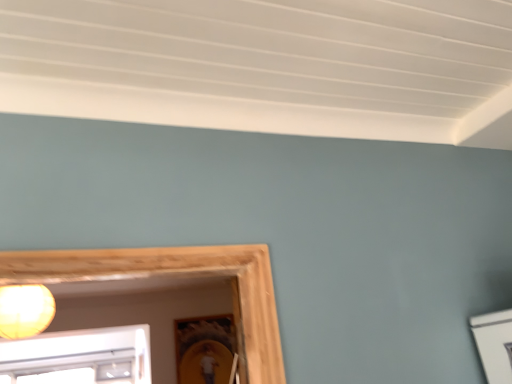
Question: Does matte yellow bulb at upper left appear on the left side of matte wooden picture frame at lower center?

Choices:
 (A) yes
 (B) no

Answer: (A)

Question: Is matte yellow bulb at upper left directly adjacent to matte wooden picture frame at lower center?

Choices:
 (A) yes
 (B) no

Answer: (B)

Question: From the image's perspective, does matte yellow bulb at upper left appear higher than matte wooden picture frame at lower center?

Choices:
 (A) yes
 (B) no

Answer: (A)

Question: Is matte yellow bulb at upper left looking in the opposite direction of matte wooden picture frame at lower center?

Choices:
 (A) yes
 (B) no

Answer: (B)

Question: From a real-world perspective, is matte yellow bulb at upper left below matte wooden picture frame at lower center?

Choices:
 (A) yes
 (B) no

Answer: (B)

Question: Is matte yellow bulb at upper left shorter than matte wooden picture frame at lower center?

Choices:
 (A) yes
 (B) no

Answer: (A)

Question: Considering the relative positions of matte wooden picture frame at lower center and matte yellow bulb at upper left in the image provided, is matte wooden picture frame at lower center to the left of matte yellow bulb at upper left from the viewer's perspective?

Choices:
 (A) no
 (B) yes

Answer: (A)

Question: Is matte wooden picture frame at lower center thinner than matte yellow bulb at upper left?

Choices:
 (A) no
 (B) yes

Answer: (B)

Question: Does matte wooden picture frame at lower center have a greater height compared to matte yellow bulb at upper left?

Choices:
 (A) no
 (B) yes

Answer: (B)

Question: Is there a large distance between matte wooden picture frame at lower center and matte yellow bulb at upper left?

Choices:
 (A) yes
 (B) no

Answer: (A)

Question: From the image's perspective, is matte wooden picture frame at lower center located above matte yellow bulb at upper left?

Choices:
 (A) yes
 (B) no

Answer: (B)

Question: Is matte wooden picture frame at lower center in front of matte yellow bulb at upper left?

Choices:
 (A) yes
 (B) no

Answer: (B)

Question: Is matte yellow bulb at upper left in front of or behind matte wooden picture frame at lower center in the image?

Choices:
 (A) front
 (B) behind

Answer: (A)